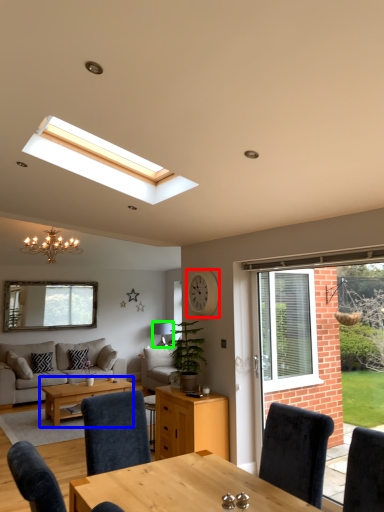
Question: Considering the real-world distances, which object is closest to clock (highlighted by a red box)? coffee table (highlighted by a blue box) or lamp (highlighted by a green box).

Choices:
 (A) coffee table
 (B) lamp

Answer: (A)